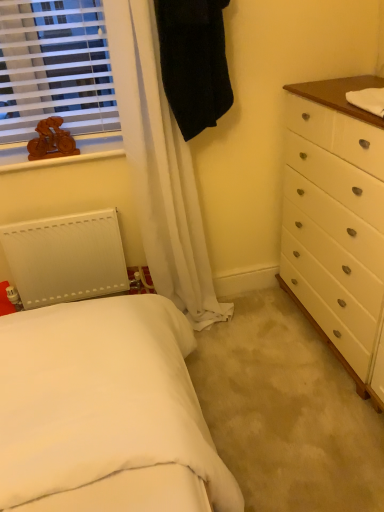
Question: Is brown wooden counter top at upper right oriented towards wooden bicycle at upper left?

Choices:
 (A) yes
 (B) no

Answer: (A)

Question: Would you say brown wooden counter top at upper right contains wooden bicycle at upper left?

Choices:
 (A) yes
 (B) no

Answer: (B)

Question: Is brown wooden counter top at upper right positioned in front of wooden bicycle at upper left?

Choices:
 (A) yes
 (B) no

Answer: (A)

Question: Is the position of brown wooden counter top at upper right more distant than that of wooden bicycle at upper left?

Choices:
 (A) yes
 (B) no

Answer: (B)

Question: Considering the relative sizes of brown wooden counter top at upper right and wooden bicycle at upper left in the image provided, is brown wooden counter top at upper right smaller than wooden bicycle at upper left?

Choices:
 (A) yes
 (B) no

Answer: (B)

Question: Looking at the image, does brown wooden counter top at upper right seem bigger or smaller compared to wooden bicycle at upper left?

Choices:
 (A) big
 (B) small

Answer: (A)

Question: Is point (284, 89) positioned closer to the camera than point (59, 159)?

Choices:
 (A) closer
 (B) farther

Answer: (B)

Question: Is brown wooden counter top at upper right inside or outside of wooden bicycle at upper left?

Choices:
 (A) inside
 (B) outside

Answer: (B)

Question: From the image's perspective, is brown wooden counter top at upper right located above or below wooden bicycle at upper left?

Choices:
 (A) below
 (B) above

Answer: (B)

Question: From a real-world perspective, relative to wooden bicycle at upper left, is black fabric robe at upper center vertically above or below?

Choices:
 (A) below
 (B) above

Answer: (B)

Question: Is point (221, 33) positioned closer to the camera than point (39, 156)?

Choices:
 (A) closer
 (B) farther

Answer: (A)

Question: Is black fabric robe at upper center in front of or behind wooden bicycle at upper left in the image?

Choices:
 (A) front
 (B) behind

Answer: (A)

Question: In terms of width, does black fabric robe at upper center look wider or thinner when compared to wooden bicycle at upper left?

Choices:
 (A) wide
 (B) thin

Answer: (A)

Question: In terms of width, does white matte radiator at lower left look wider or thinner when compared to black fabric robe at upper center?

Choices:
 (A) thin
 (B) wide

Answer: (A)

Question: Based on their positions, is white matte radiator at lower left located to the left or right of black fabric robe at upper center?

Choices:
 (A) left
 (B) right

Answer: (A)